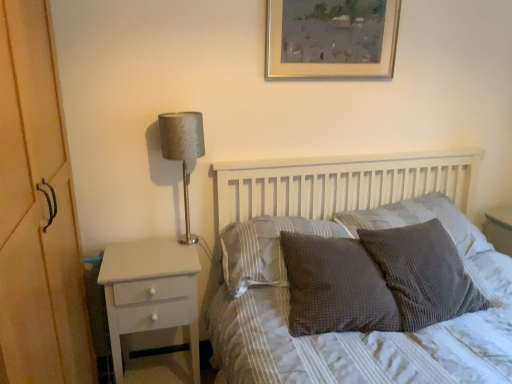
Image resolution: width=512 pixels, height=384 pixels. I want to click on free point above white painted wood nightstand at left (from a real-world perspective), so click(148, 258).